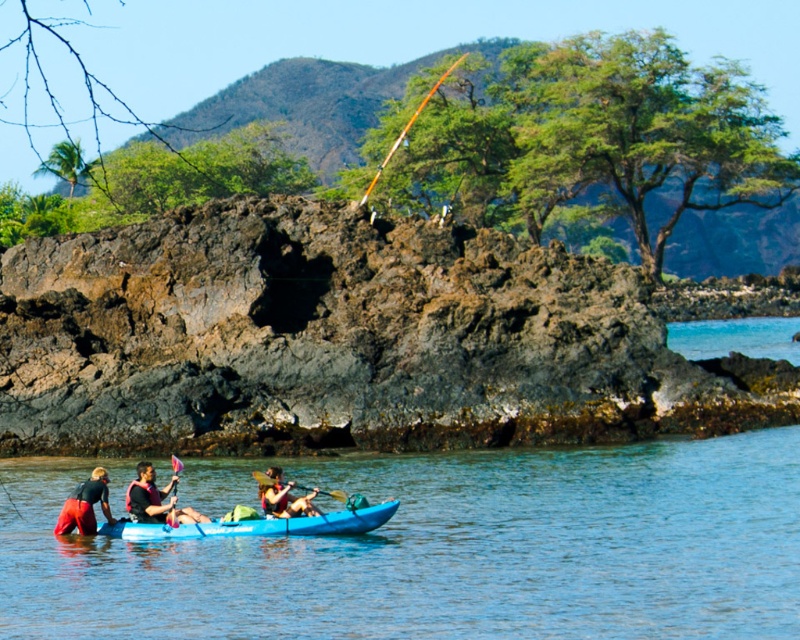
You are standing on the shore and see the red fabric kayak at lower left. If you want to throw a lifebuoy to the kayak, will it be within a 100 feet range?

The red fabric kayak at lower left is 132.46 feet away from the viewer, which exceeds the 100 feet range. Therefore, the lifebuoy cannot reach it.

You are planning to store two kayaks in your garage. You have a narrow storage space that can only accommodate a kayak with a width of 2 feet or less. Based on the image, which of the two kayaks, the red fabric kayak at lower left or the matte red kayak at center, is more likely to fit in the narrow space?

The red fabric kayak at lower left is thinner than the matte red kayak at center, so the red fabric kayak at lower left is more likely to fit in the narrow storage space.

You are a photographer trying to capture the kayakers from the shore. You notice the red fabric kayak at lower left and the yellow wood paddle at center. Which object should you focus on first if you want to take a photo that includes both, considering their positions?

The red fabric kayak at lower left is located above the yellow wood paddle at center, so you should focus on the red fabric kayak at lower left first to ensure both are in frame.